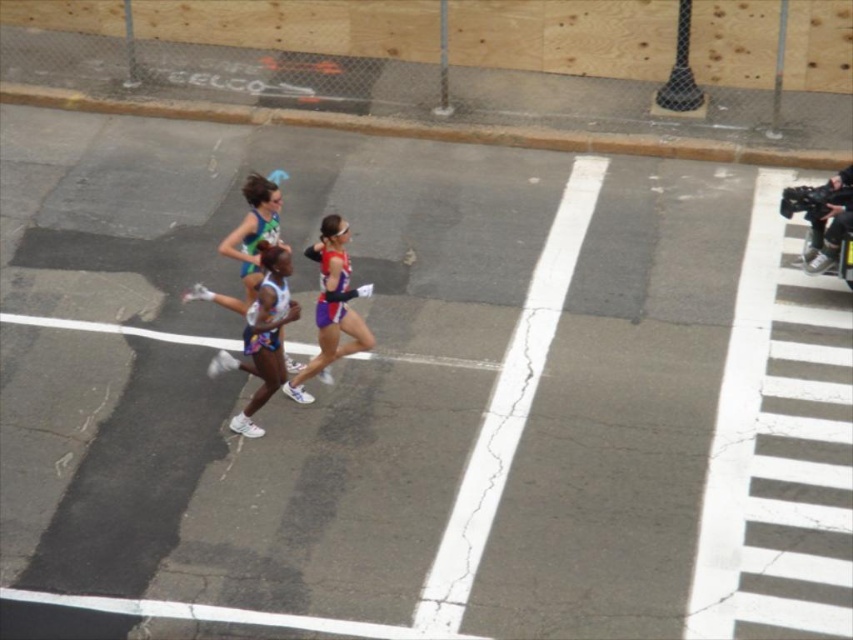
You are a photographer at the marathon event and want to capture a photo where the shiny purple shorts at center and the shiny blue tank top at center are both visible. Since you want to highlight the height difference between them, which object should you focus on to ensure the height difference is clear?

The shiny purple shorts at center is taller than the shiny blue tank top at center, so focusing on the shiny purple shorts at center would emphasize the height difference between them.

You are a photographer at the marathon event and want to capture both the white athletic wear at center and the shiny blue tank top at center in your photo. Which clothing item will appear bigger in the photo?

The white athletic wear at center will appear bigger in the photo because it is larger in size than the shiny blue tank top at center.